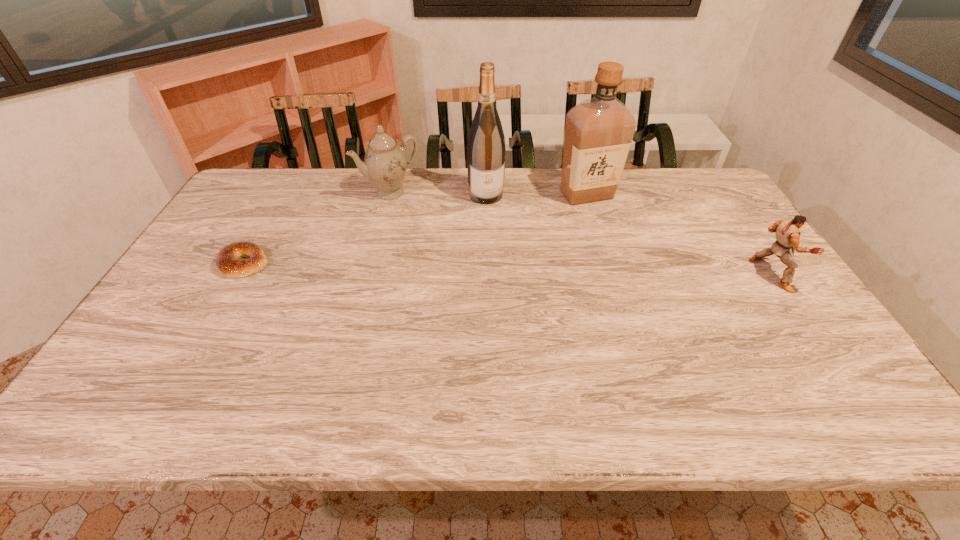
Locate an element on the screen. The image size is (960, 540). vacant space that satisfies the following two spatial constraints: 1. on the front side of the third object from left to right; 2. on the front-facing side of the rightmost object is located at coordinates (488, 274).

I want to click on free space in the image that satisfies the following two spatial constraints: 1. on the front side of the puncher; 2. on the front-facing side of the fourth object from right to left, so click(x=369, y=274).

At what (x,y) coordinates should I click in order to perform the action: click on vacant area in the image that satisfies the following two spatial constraints: 1. on the front side of the liquor; 2. on the front-facing side of the fourth tallest object. Please return your answer as a coordinate pair (x, y). This screenshot has height=540, width=960. Looking at the image, I should click on (612, 274).

The height and width of the screenshot is (540, 960). I want to click on free space that satisfies the following two spatial constraints: 1. on the back side of the third object from right to left; 2. on the right side of the liquor, so click(x=486, y=194).